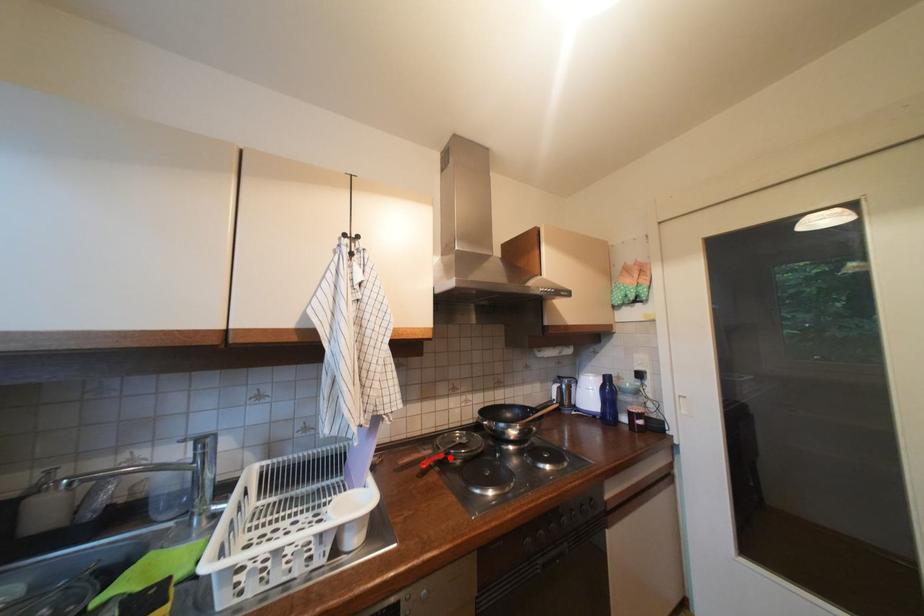
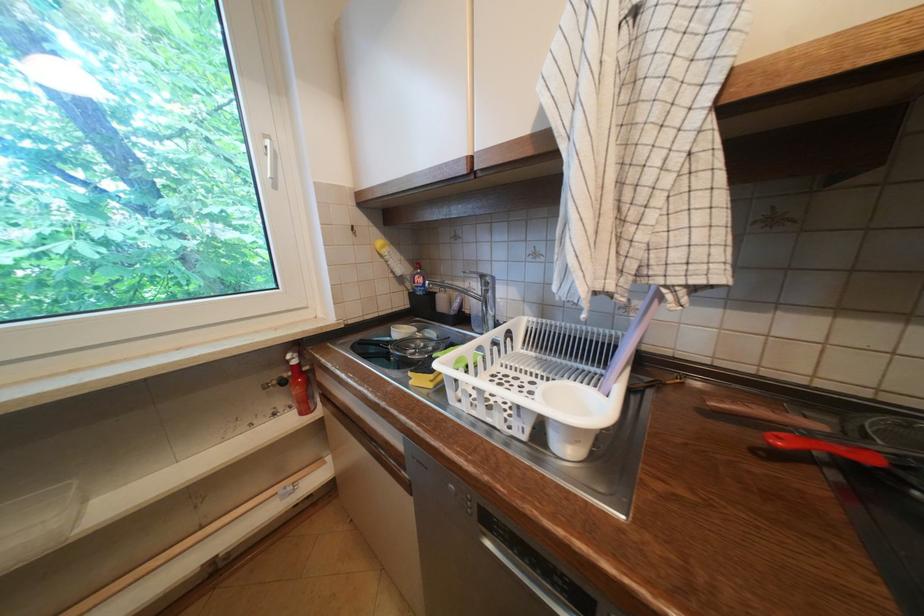
Find the pixel in the second image that matches the highlighted location in the first image.

(881, 462)